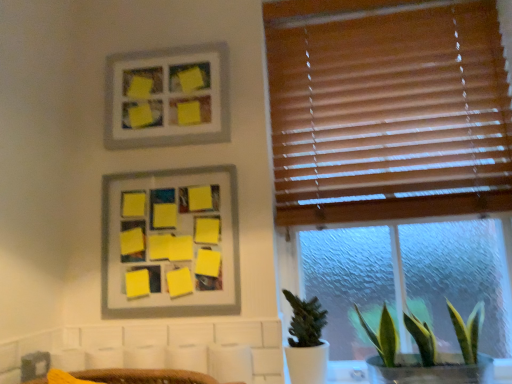
Question: In terms of height, does yellow matte picture frame at upper center, which is the 2th picture frame from bottom to top, look taller or shorter compared to yellow matte board at upper center, which appears as the 2th picture frame when viewed from the top?

Choices:
 (A) tall
 (B) short

Answer: (B)

Question: From a real-world perspective, is yellow matte picture frame at upper center, the first picture frame from the top, positioned above or below yellow matte board at upper center, which is the first picture frame in bottom-to-top order?

Choices:
 (A) above
 (B) below

Answer: (A)

Question: Considering the real-world distances, which object is farthest from the green leafy plant at lower right, which ranks as the 1th houseplant in right-to-left order?

Choices:
 (A) yellow matte picture frame at upper center, the first picture frame from the top
 (B) wooden blinds at upper right
 (C) yellow matte board at upper center, which appears as the 2th picture frame when viewed from the top
 (D) green matte plant at lower right, which appears as the first houseplant when viewed from the left

Answer: (A)

Question: Which object is positioned farthest from the wooden blinds at upper right?

Choices:
 (A) yellow matte picture frame at upper center, the first picture frame from the top
 (B) green leafy plant at lower right, which ranks as the 1th houseplant in right-to-left order
 (C) yellow matte board at upper center, which appears as the 2th picture frame when viewed from the top
 (D) green matte plant at lower right, which appears as the first houseplant when viewed from the left

Answer: (D)